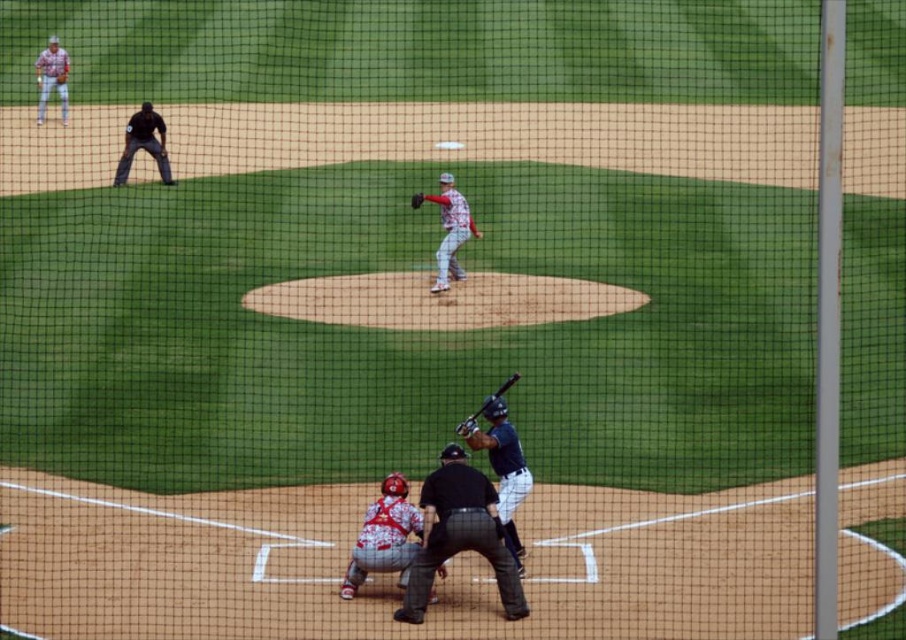
Question: Which point is closer to the camera?

Choices:
 (A) white padded catcher at center
 (B) black leather umpire at center

Answer: (B)

Question: Which point is closer to the camera?

Choices:
 (A) dark gray uniform at upper left
 (B) shiny black bat at lower center
 (C) white jersey baseball player at upper left
 (D) dark blue uniform at center

Answer: (D)

Question: Where is dark blue uniform at center located in relation to matte white uniform at center in the image?

Choices:
 (A) above
 (B) below

Answer: (B)

Question: Which of the following is the farthest from the observer?

Choices:
 (A) black leather umpire at center
 (B) white padded catcher at center
 (C) matte white uniform at center
 (D) white jersey baseball player at upper left

Answer: (D)

Question: Does matte white uniform at center appear on the left side of shiny black bat at lower center?

Choices:
 (A) no
 (B) yes

Answer: (B)

Question: From the image, what is the correct spatial relationship of dark blue uniform at center in relation to white jersey baseball player at upper left?

Choices:
 (A) above
 (B) below

Answer: (B)